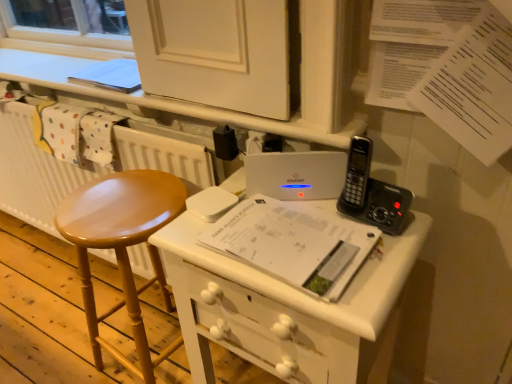
Question: From a real-world perspective, is shiny wood stool at left physically located above or below black plastic phone at upper right?

Choices:
 (A) below
 (B) above

Answer: (A)

Question: Does point [150, 178] appear closer or farther from the camera than point [394, 193]?

Choices:
 (A) closer
 (B) farther

Answer: (B)

Question: Which of these objects is positioned farthest from the shiny wood stool at left?

Choices:
 (A) white plastic router at center
 (B) white painted wood desk at center
 (C) white paper at center
 (D) white matte radiator at left
 (E) black plastic phone at upper right

Answer: (E)

Question: Which object is the farthest from the black plastic phone at upper right?

Choices:
 (A) shiny wood stool at left
 (B) white plastic router at center
 (C) white matte radiator at left
 (D) white painted wood desk at center
 (E) white paper at center

Answer: (C)